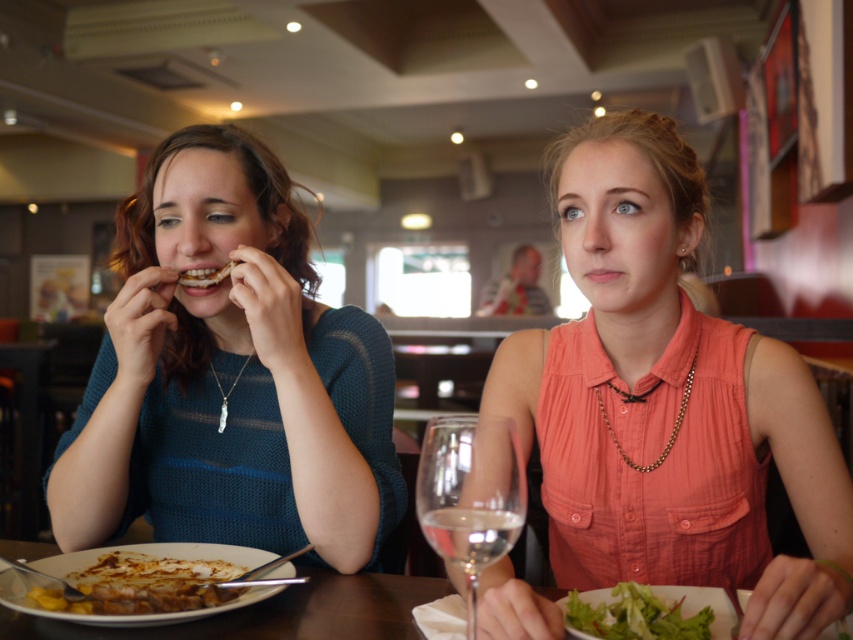
Question: Which point is closer to the camera taking this photo?

Choices:
 (A) (419, 596)
 (B) (668, 449)
 (C) (695, 460)

Answer: (A)

Question: Can you confirm if matte coral blouse at center is wider than white pearl necklace at center?

Choices:
 (A) no
 (B) yes

Answer: (B)

Question: Among these objects, which one is farthest from the camera?

Choices:
 (A) white pearl necklace at center
 (B) wooden table at center
 (C) gold chain necklace at center

Answer: (A)

Question: Can you confirm if matte coral blouse at center is wider than knitted teal sweater at left?

Choices:
 (A) no
 (B) yes

Answer: (A)

Question: Does matte coral blouse at center appear under green leafy salad at lower right?

Choices:
 (A) no
 (B) yes

Answer: (A)

Question: Which is farther from the golden brown steak at lower left?

Choices:
 (A) white pearl necklace at center
 (B) gold chain necklace at center
 (C) transparent glass at center
 (D) knitted teal sweater at left

Answer: (B)